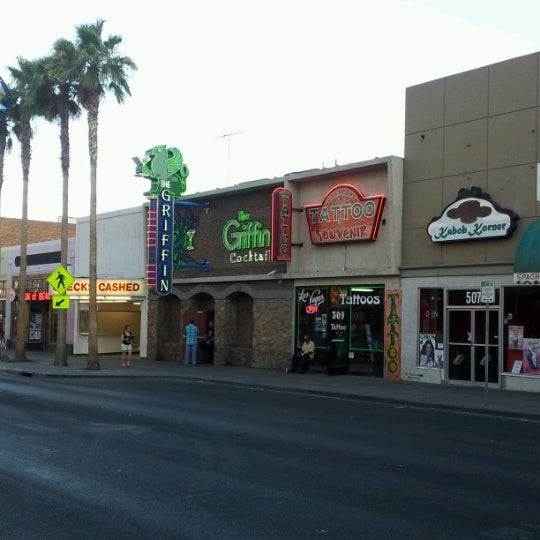
I want to click on window, so click(422, 329).